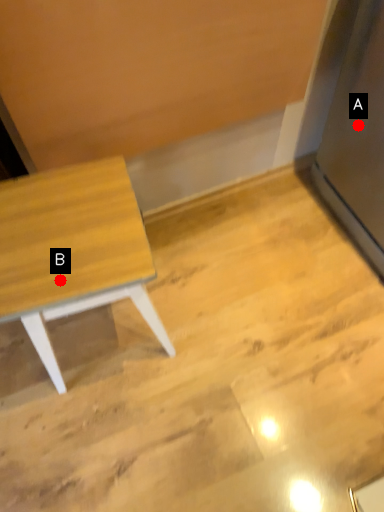
Question: Two points are circled on the image, labeled by A and B beside each circle. Which point is closer to the camera taking this photo?

Choices:
 (A) A is closer
 (B) B is closer

Answer: (B)